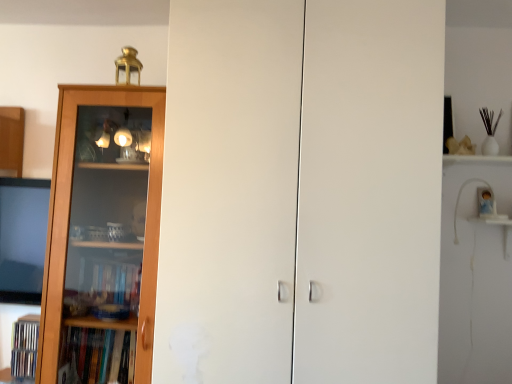
Question: Which is correct: white matte cabinet doors at center is inside wooden bookcase at left, or outside of it?

Choices:
 (A) outside
 (B) inside

Answer: (A)

Question: In terms of width, does white matte cabinet doors at center look wider or thinner when compared to wooden bookcase at left?

Choices:
 (A) wide
 (B) thin

Answer: (A)

Question: Is white matte cabinet doors at center to the left or to the right of wooden bookcase at left in the image?

Choices:
 (A) right
 (B) left

Answer: (A)

Question: Is wooden bookcase at left bigger or smaller than white matte cabinet doors at center?

Choices:
 (A) small
 (B) big

Answer: (A)

Question: From a real-world perspective, is wooden bookcase at left above or below white matte cabinet doors at center?

Choices:
 (A) below
 (B) above

Answer: (A)

Question: Is point (57, 286) positioned closer to the camera than point (385, 160)?

Choices:
 (A) closer
 (B) farther

Answer: (B)

Question: Considering their positions, is wooden bookcase at left located in front of or behind white matte cabinet doors at center?

Choices:
 (A) front
 (B) behind

Answer: (B)